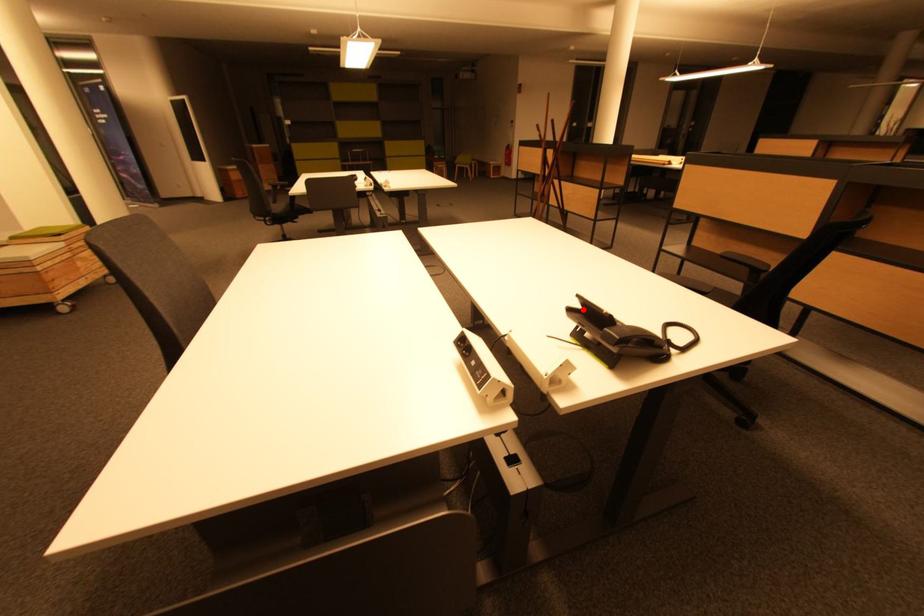
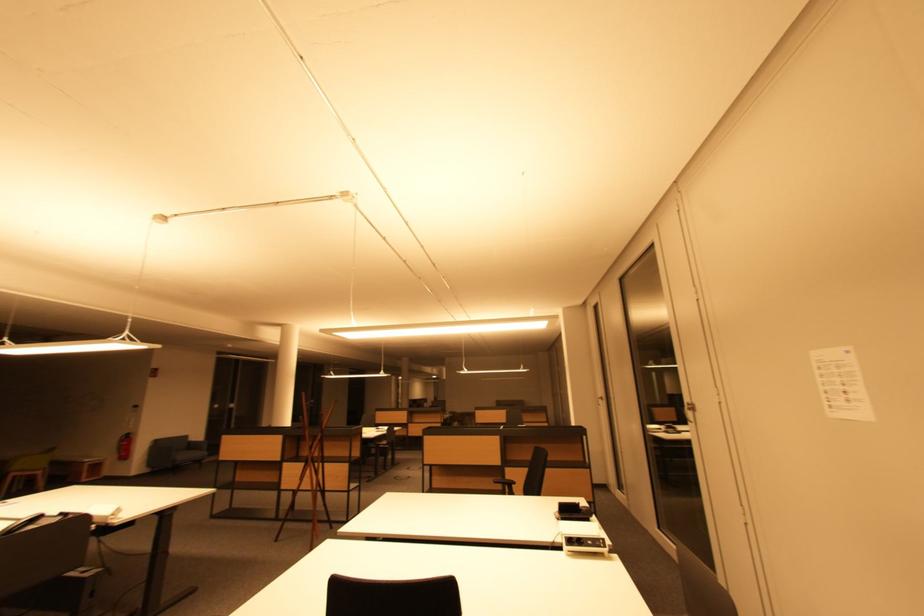
Question: A red point is marked in image1. In image2, is the corresponding 3D point closer to the camera or farther? Reply with the corresponding letter.

Choices:
 (A) The corresponding 3D point is closer.
 (B) The corresponding 3D point is farther.

Answer: (A)